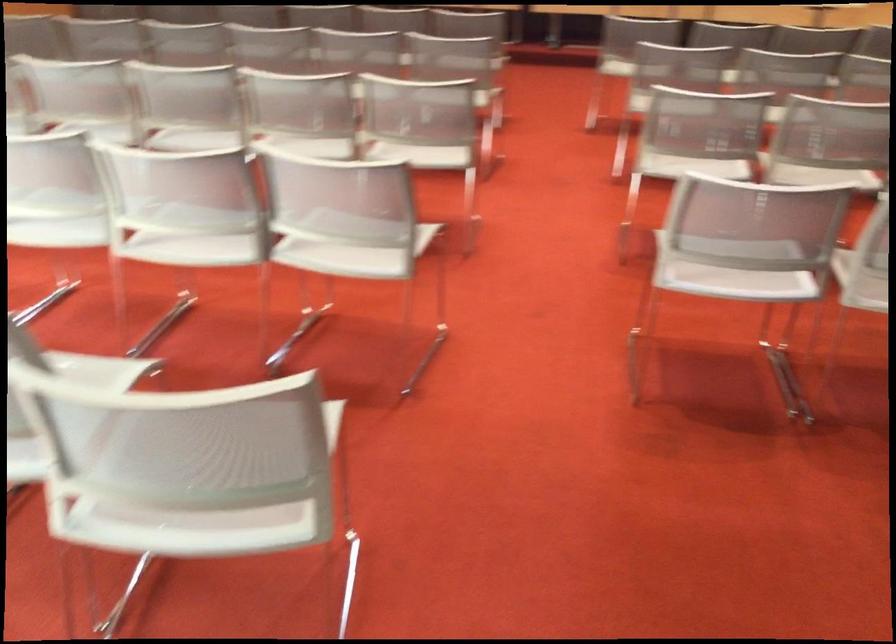
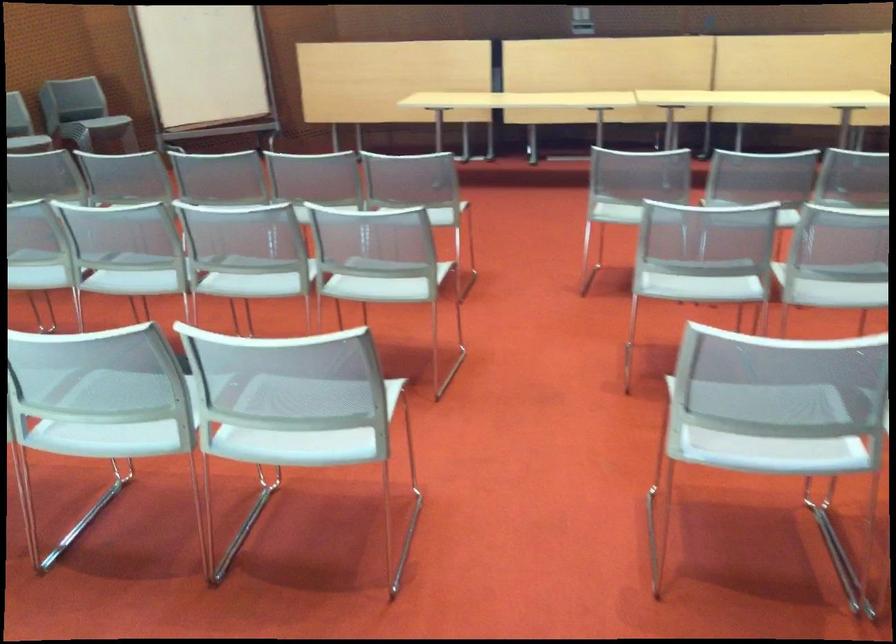
Find the pixel in the second image that matches point (694, 144) in the first image.

(772, 424)